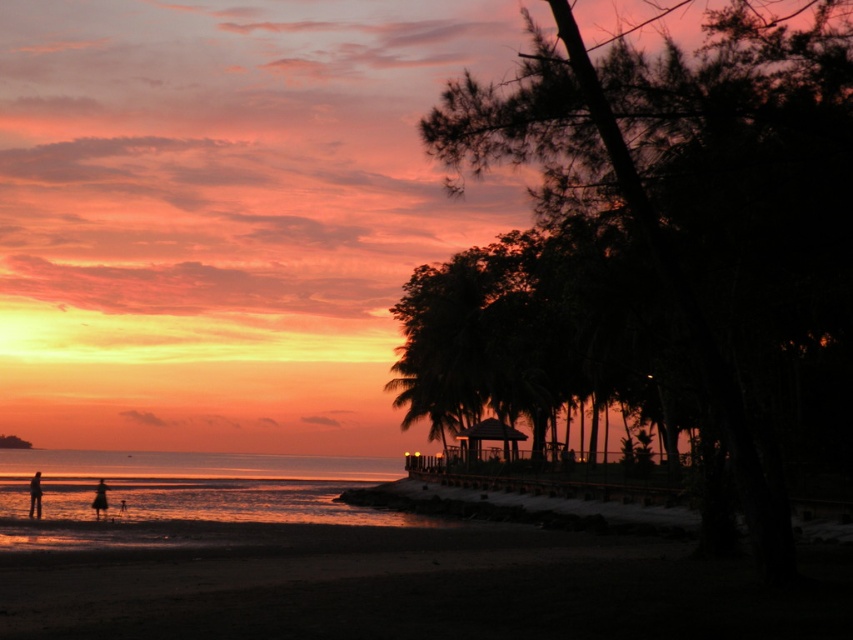
Question: Can you confirm if dark sand at lower left is thinner than sandy water at lower left?

Choices:
 (A) no
 (B) yes

Answer: (B)

Question: Can you confirm if dark sand at lower left is positioned below sandy water at lower left?

Choices:
 (A) yes
 (B) no

Answer: (B)

Question: Which object appears farthest from the camera in this image?

Choices:
 (A) sandy water at lower left
 (B) dark sand at lower left

Answer: (A)

Question: Observing the image, what is the correct spatial positioning of dark sand at lower left in reference to sandy water at lower left?

Choices:
 (A) below
 (B) above

Answer: (B)